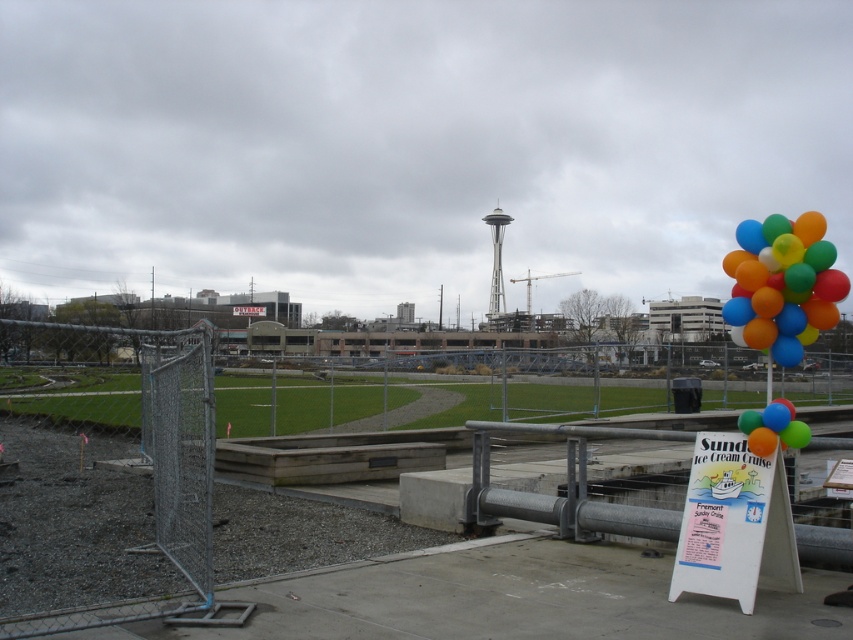
Question: Where is metallic chain-link fence at lower left located in relation to multicolored glossy balloons at right in the image?

Choices:
 (A) left
 (B) right

Answer: (A)

Question: Can you confirm if smooth concrete platform at center is wider than white cardboard sign at lower right?

Choices:
 (A) no
 (B) yes

Answer: (B)

Question: Is smooth concrete platform at center positioned behind white cardboard sign at lower right?

Choices:
 (A) yes
 (B) no

Answer: (B)

Question: Considering the real-world distances, which object is farthest from the white cardboard sign at lower right?

Choices:
 (A) smooth concrete platform at center
 (B) metallic chain-link fence at lower left
 (C) multicolored glossy balloons at right

Answer: (B)

Question: Which object is closer to the camera taking this photo?

Choices:
 (A) smooth concrete platform at center
 (B) white cardboard sign at lower right
 (C) multicolored glossy balloons at right
 (D) metallic chain-link fence at lower left

Answer: (A)

Question: Which of these objects is positioned closest to the multicolored glossy balloons at right?

Choices:
 (A) smooth concrete platform at center
 (B) white cardboard sign at lower right
 (C) metallic chain-link fence at lower left

Answer: (B)